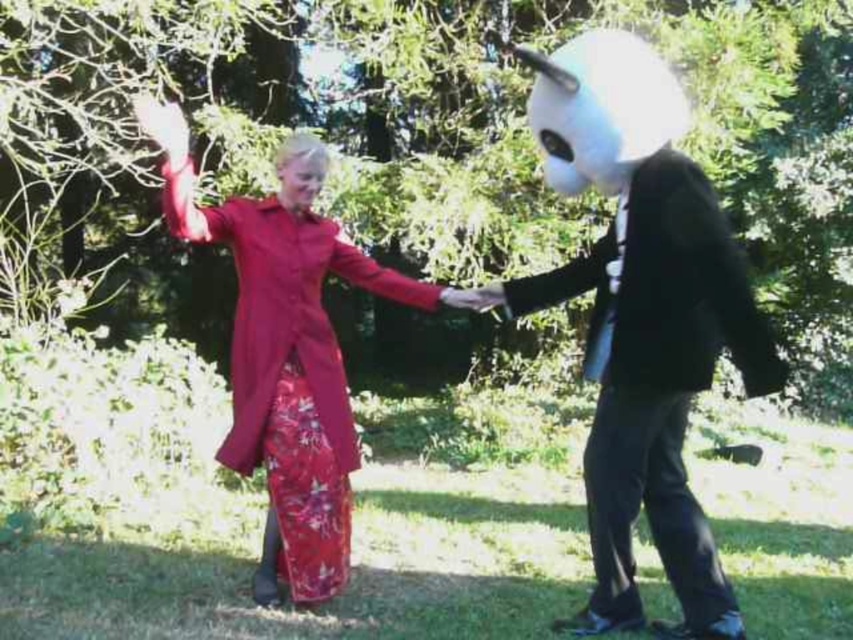
You are a photographer trying to capture a photo of both individuals in the park. You notice two points marked in the scene. The first point, point (619, 508), is near the person in the red coat, and the second point, point (706, 563), is near the person in the black suit. Since you want to focus on the person closer to the camera, which point should you adjust your camera focus to?

Point (619, 508) is closer to the camera than point (706, 563), so you should focus on point (619, 508) to capture the person in the red coat more clearly.

You are a photographer setting up a shoot in a park with two subjects. One is wearing a matte black suit at center, and the other has a white matte mask at right. To ensure both are clearly visible in the photo, which subject should you focus on first considering their sizes?

The matte black suit at center is larger in size than the white matte mask at right, so you should focus on the matte black suit at center first to ensure it is clearly visible.